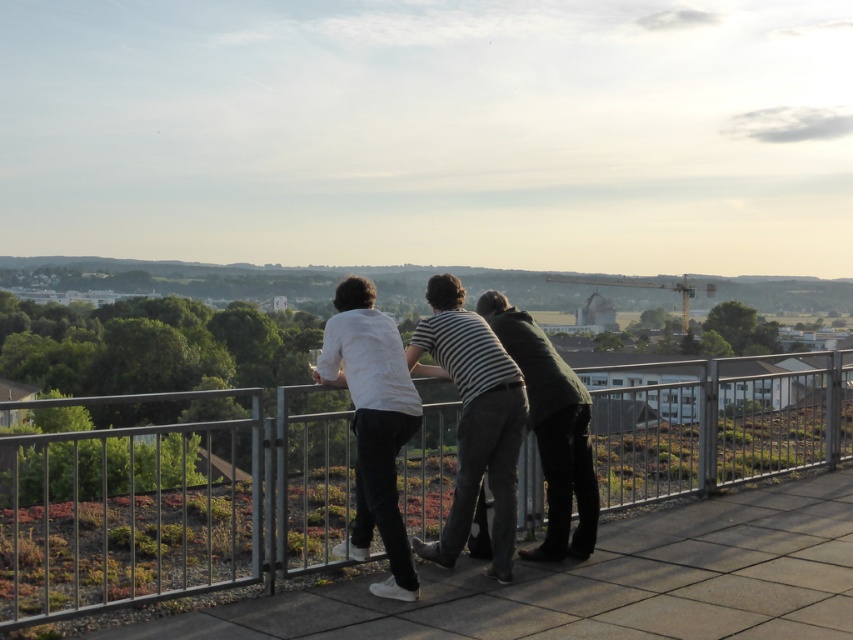
Can you confirm if metallic silver fence at center is positioned above dark green sweater at center?

No.

At what (x,y) coordinates should I click in order to perform the action: click on metallic silver fence at center. Please return your answer as a coordinate pair (x, y). Looking at the image, I should click on (170, 509).

Between striped cotton shirt at center and white matte shirt at center, which one has more height?

With more height is striped cotton shirt at center.

Measure the distance between point (519, 426) and camera.

A distance of 21.97 feet exists between point (519, 426) and camera.

You are a GUI agent. You are given a task and a screenshot of the screen. Output one action in this format:
    pyautogui.click(x=<x>, y=<y>)
    Task: Click on the striped cotton shirt at center
    This screenshot has height=640, width=853.
    Given the screenshot: What is the action you would take?
    473,420

Locate an element on the screen. striped cotton shirt at center is located at coordinates (473, 420).

Is point (302, 440) positioned before point (432, 545)?

Yes.

Who is lower down, metallic silver fence at center or striped cotton shirt at center?

metallic silver fence at center is below.

The image size is (853, 640). Describe the element at coordinates (170, 509) in the screenshot. I see `metallic silver fence at center` at that location.

Locate an element on the screen. This screenshot has height=640, width=853. metallic silver fence at center is located at coordinates [x=170, y=509].